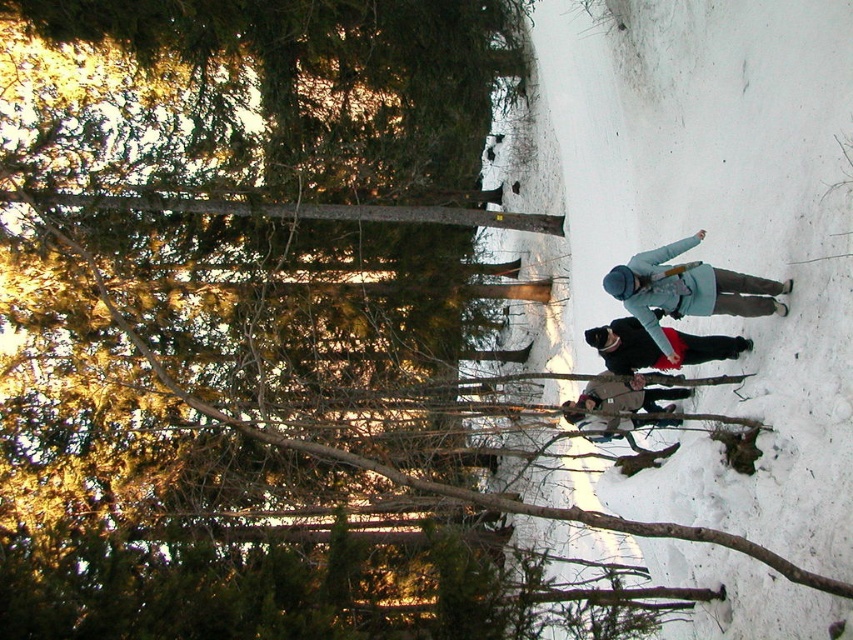
Question: Which point is closer to the camera?

Choices:
 (A) (648, 394)
 (B) (637, 275)
 (C) (608, 358)

Answer: (B)

Question: Is matte blue jacket at center thinner than brown woolen jacket at center?

Choices:
 (A) yes
 (B) no

Answer: (B)

Question: Which of the following is the closest to the observer?

Choices:
 (A) (747, 342)
 (B) (604, 420)

Answer: (A)

Question: From the image, what is the correct spatial relationship of matte blue jacket at center in relation to black fur coat at center?

Choices:
 (A) below
 (B) above

Answer: (B)

Question: Does matte blue jacket at center appear under brown woolen jacket at center?

Choices:
 (A) yes
 (B) no

Answer: (B)

Question: Which point is closer to the camera?

Choices:
 (A) brown woolen jacket at center
 (B) black fur coat at center

Answer: (A)